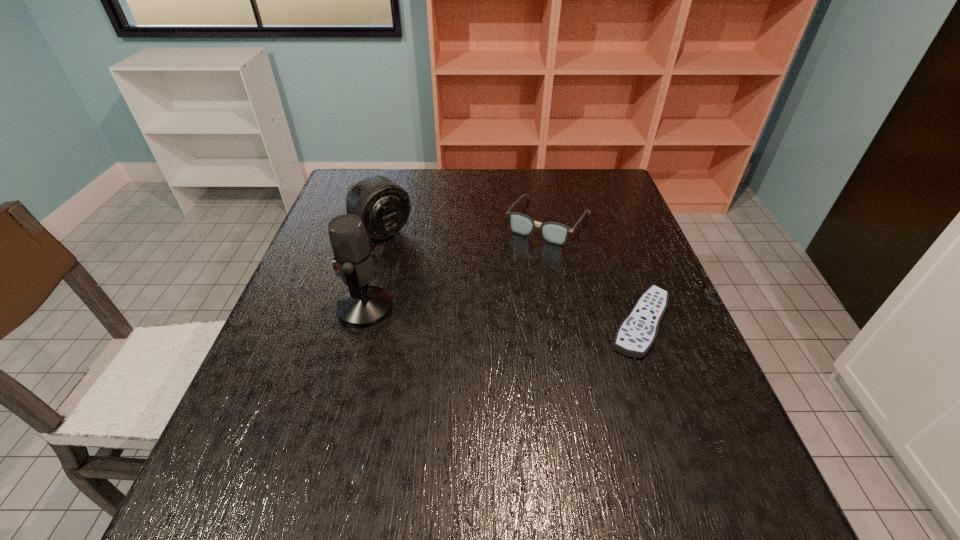
At what (x,y) coordinates should I click in order to perform the action: click on vacant space located 0.120m on the front-facing side of the telephoto lens. Please return your answer as a coordinate pair (x, y). Image resolution: width=960 pixels, height=540 pixels. Looking at the image, I should click on (425, 266).

Identify the location of vacant position located 0.280m on the front-facing side of the telephoto lens. The image size is (960, 540). (466, 299).

This screenshot has height=540, width=960. Identify the location of vacant space situated 0.330m on the front-facing side of the telephoto lens. (480, 310).

At what (x,y) coordinates should I click in order to perform the action: click on object positioned at the far edge. Please return your answer as a coordinate pair (x, y). This screenshot has height=540, width=960. Looking at the image, I should click on (556, 233).

Find the location of `microphone that is at the left edge`. microphone that is at the left edge is located at coordinates (362, 306).

This screenshot has width=960, height=540. What are the coordinates of `telephoto lens that is at the left edge` in the screenshot? It's located at pos(384,207).

You are a GUI agent. You are given a task and a screenshot of the screen. Output one action in this format:
    pyautogui.click(x=<x>, y=<y>)
    Task: Click on the remote control at the right edge
    This screenshot has height=540, width=960.
    Given the screenshot: What is the action you would take?
    pyautogui.click(x=636, y=334)

The image size is (960, 540). Identify the location of spectacles that is at the right edge. (556, 233).

Identify the location of object located at the far right corner. The height and width of the screenshot is (540, 960). (556, 233).

The image size is (960, 540). In the image, there is a desktop. Find the location of `vacant space at the far edge`. vacant space at the far edge is located at coordinates (459, 180).